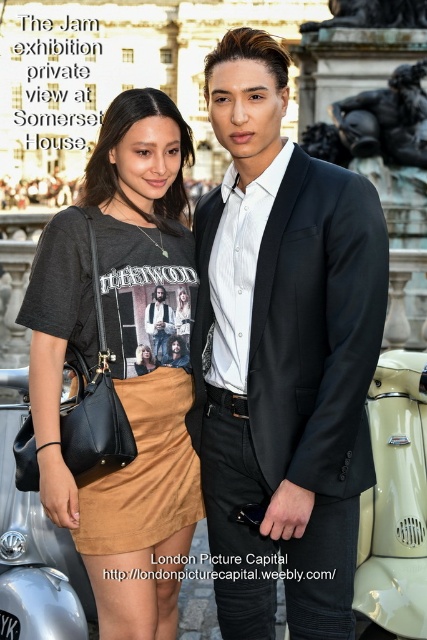
Question: Based on their relative distances, which object is nearer to the black smooth suit at center?

Choices:
 (A) matte black t-shirt at center
 (B) matte black suit at center
 (C) suede skirt at center

Answer: (A)

Question: Can you confirm if black smooth suit at center is positioned to the left of matte black suit at center?

Choices:
 (A) yes
 (B) no

Answer: (B)

Question: Is black smooth suit at center thinner than suede skirt at center?

Choices:
 (A) yes
 (B) no

Answer: (B)

Question: Which point is farther from the camera taking this photo?

Choices:
 (A) (205, 216)
 (B) (157, 337)
 (C) (178, 444)
 (D) (111, 545)

Answer: (A)

Question: Which object appears farthest from the camera in this image?

Choices:
 (A) matte black t-shirt at center
 (B) black smooth suit at center

Answer: (A)

Question: Can you confirm if suede skirt at center is positioned below matte black suit at center?

Choices:
 (A) yes
 (B) no

Answer: (A)